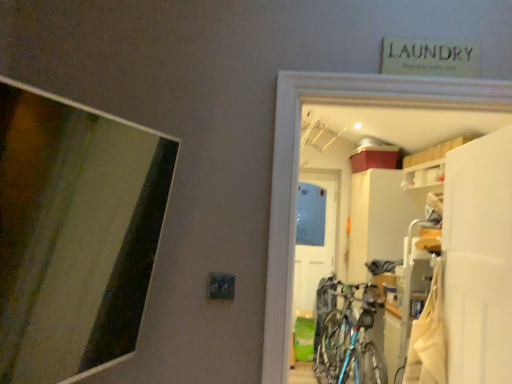
The width and height of the screenshot is (512, 384). Find the location of `white fabric laundry at lower right`. white fabric laundry at lower right is located at coordinates 428,338.

Describe the element at coordinates (314, 247) in the screenshot. I see `white matte door at center` at that location.

Measure the distance between point (457, 105) and camera.

They are 1.35 meters apart.

You are a GUI agent. You are given a task and a screenshot of the screen. Output one action in this format:
    pyautogui.click(x=<x>, y=<y>)
    Task: Click on the blue metallic bicycle at center
    
    Given the screenshot: What is the action you would take?
    pyautogui.click(x=350, y=339)

Based on their positions, is white matte cabinet at upper right located to the left or right of white matte door at center?

From the image, it's evident that white matte cabinet at upper right is to the right of white matte door at center.

At what (x,y) coordinates should I click in order to perform the action: click on cabinet that is above the white matte door at center (from the image's perspective). Please return your answer as a coordinate pair (x, y). This screenshot has width=512, height=384. Looking at the image, I should click on (424, 175).

Considering the points (416, 181) and (307, 357), which point is in front, point (416, 181) or point (307, 357)?

Positioned in front is point (416, 181).

Between white matte cabinet at upper right and white matte door at center, which one has smaller size?

white matte cabinet at upper right.

From the image's perspective, between metallic bicycle at center and white matte screen door at right, which one is located above?

metallic bicycle at center appears higher in the image.

Does metallic bicycle at center appear on the right side of white matte screen door at right?

Incorrect, metallic bicycle at center is not on the right side of white matte screen door at right.

In the scene shown: Can you confirm if metallic bicycle at center is taller than white matte screen door at right?

In fact, metallic bicycle at center may be shorter than white matte screen door at right.

Is blue metallic bicycle at center situated inside metallic bicycle at center or outside?

blue metallic bicycle at center exists outside the volume of metallic bicycle at center.

What's the angular difference between blue metallic bicycle at center and metallic bicycle at center's facing directions?

The angular difference between blue metallic bicycle at center and metallic bicycle at center is 85.1 degrees.

Is blue metallic bicycle at center next to metallic bicycle at center and touching it?

No.

Are white matte screen door at right and white matte door at center making contact?

No, white matte screen door at right is not beside white matte door at center.

Considering the sizes of objects white matte screen door at right and white matte door at center in the image provided, who is taller, white matte screen door at right or white matte door at center?

→ white matte door at center is taller.

Which object is positioned more to the right, white matte screen door at right or white matte door at center?

white matte screen door at right is more to the right.

Is white matte screen door at right facing away from white matte door at center?

white matte screen door at right is not turned away from white matte door at center.

Can you confirm if white matte door at center is taller than metallic bicycle at center?

Indeed, white matte door at center has a greater height compared to metallic bicycle at center.

Which is in front, point (303, 202) or point (481, 90)?

Positioned in front is point (481, 90).

At what (x,y) coordinates should I click in order to perform the action: click on door located below the metallic bicycle at center (from the image's perspective). Please return your answer as a coordinate pair (x, y). The width and height of the screenshot is (512, 384). Looking at the image, I should click on (314, 247).

From the picture: Is white matte door at center at the right side of metallic bicycle at center?

Indeed, white matte door at center is positioned on the right side of metallic bicycle at center.

I want to click on garage in front of the white fabric laundry at lower right, so click(x=298, y=166).

From the image's perspective, would you say metallic bicycle at center is positioned over white fabric laundry at lower right?

Yes, from the image's perspective, metallic bicycle at center is above white fabric laundry at lower right.

Considering the relative sizes of metallic bicycle at center and white fabric laundry at lower right in the image provided, is metallic bicycle at center bigger than white fabric laundry at lower right?

Yes.

Considering the sizes of metallic bicycle at center and white fabric laundry at lower right in the image, is metallic bicycle at center taller or shorter than white fabric laundry at lower right?

Clearly, metallic bicycle at center is taller compared to white fabric laundry at lower right.

Looking at this image, from the image's perspective, who appears lower, white fabric laundry at lower right or metallic bicycle at center?

white fabric laundry at lower right is shown below in the image.

Between white fabric laundry at lower right and metallic bicycle at center, which one is positioned in front?

Positioned in front is metallic bicycle at center.

Find the location of a particular element. This screenshot has height=384, width=512. laundry located underneath the metallic bicycle at center (from a real-world perspective) is located at coordinates (428, 338).

How many degrees apart are the facing directions of white fabric laundry at lower right and metallic bicycle at center?

The facing directions of white fabric laundry at lower right and metallic bicycle at center are 87 degrees apart.

Identify the location of cabinet on the right of white matte door at center. (424, 175).

This screenshot has height=384, width=512. Identify the location of garage on the left of white matte screen door at right. coord(298,166).

Looking at the image, which one is located further to white matte cabinet at upper right, white matte door at center or blue metallic bicycle at center?

white matte door at center is positioned further to the anchor white matte cabinet at upper right.

From the image, which object appears to be farther from white fabric laundry at lower right, metallic bicycle at center or white matte cabinet at upper right?

white matte cabinet at upper right.

From the image, which object appears to be nearer to metallic bicycle at center, blue metallic bicycle at center or white fabric laundry at lower right?

Among the two, white fabric laundry at lower right is located nearer to metallic bicycle at center.

From the image, which object appears to be nearer to white matte screen door at right, white matte door at center or white fabric laundry at lower right?

The object closer to white matte screen door at right is white fabric laundry at lower right.

From the image, which object appears to be nearer to metallic bicycle at center, white matte door at center or white fabric laundry at lower right?

The object closer to metallic bicycle at center is white fabric laundry at lower right.

When comparing their distances from white matte screen door at right, does metallic bicycle at center or blue metallic bicycle at center seem further?

blue metallic bicycle at center is further to white matte screen door at right.

Looking at the image, which one is located closer to white matte cabinet at upper right, white matte screen door at right or white fabric laundry at lower right?

white matte screen door at right.

Looking at the image, which one is located further to blue metallic bicycle at center, white fabric laundry at lower right or white matte screen door at right?

white matte screen door at right lies further to blue metallic bicycle at center than the other object.

Where is `bicycle located between metallic bicycle at center and white matte cabinet at upper right in the depth direction`? The image size is (512, 384). bicycle located between metallic bicycle at center and white matte cabinet at upper right in the depth direction is located at coordinates (350, 339).

This screenshot has width=512, height=384. In order to click on screen door between metallic bicycle at center and white fabric laundry at lower right from front to back in this screenshot , I will do `click(479, 259)`.

You are a GUI agent. You are given a task and a screenshot of the screen. Output one action in this format:
    pyautogui.click(x=<x>, y=<y>)
    Task: Click on the cabinet positioned between white fabric laundry at lower right and white matte door at center from near to far
    
    Given the screenshot: What is the action you would take?
    pyautogui.click(x=424, y=175)

In order to click on screen door located between metallic bicycle at center and white matte cabinet at upper right in the depth direction in this screenshot , I will do tap(479, 259).